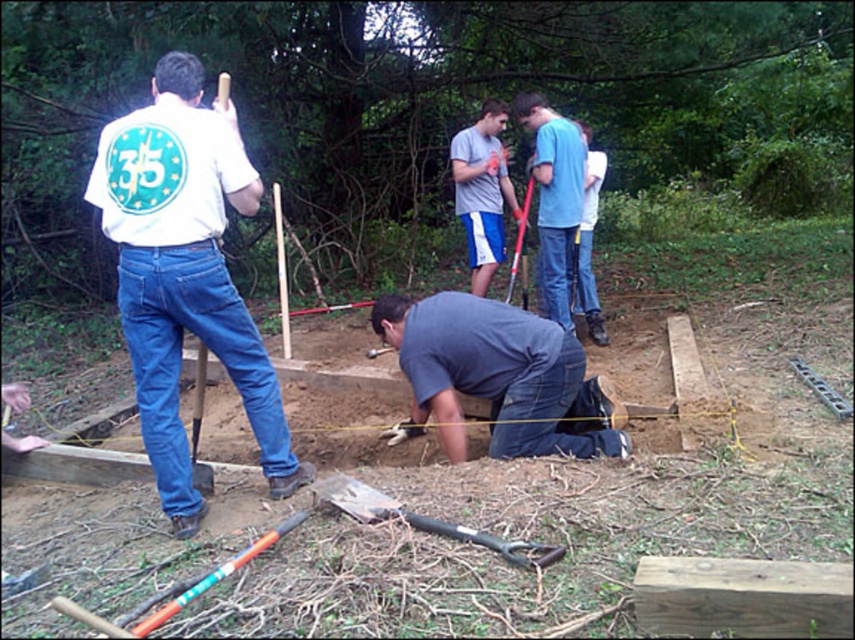
Is point (506, 454) positioned in front of point (538, 170)?

Yes.

Can you confirm if dark gray shirt at center is positioned to the left of blue jeans at center?

Yes, dark gray shirt at center is to the left of blue jeans at center.

Describe the element at coordinates (494, 376) in the screenshot. The height and width of the screenshot is (640, 855). I see `dark gray shirt at center` at that location.

Identify the location of dark gray shirt at center. This screenshot has height=640, width=855. (494, 376).

Is gray cotton shirt at center closer to the viewer compared to brushed metal shovel at lower center?

No, it is behind brushed metal shovel at lower center.

Does point (500, 186) come behind point (199, 380)?

That is True.

Locate an element on the screen. gray cotton shirt at center is located at coordinates (482, 192).

Is white matte shirt at left thinner than gray cotton shirt at center?

No, white matte shirt at left is not thinner than gray cotton shirt at center.

The image size is (855, 640). What are the coordinates of `white matte shirt at left` in the screenshot? It's located at (184, 275).